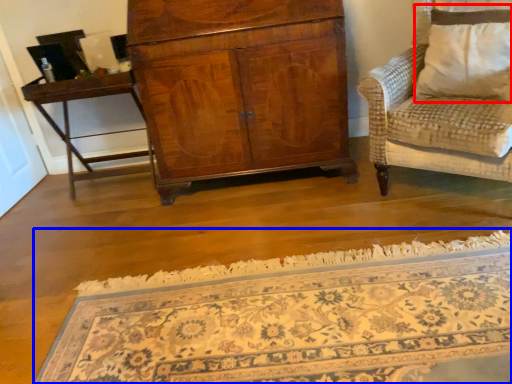
Question: Which of the following is the farthest to the observer, pillow (highlighted by a red box) or mat (highlighted by a blue box)?

Choices:
 (A) pillow
 (B) mat

Answer: (A)